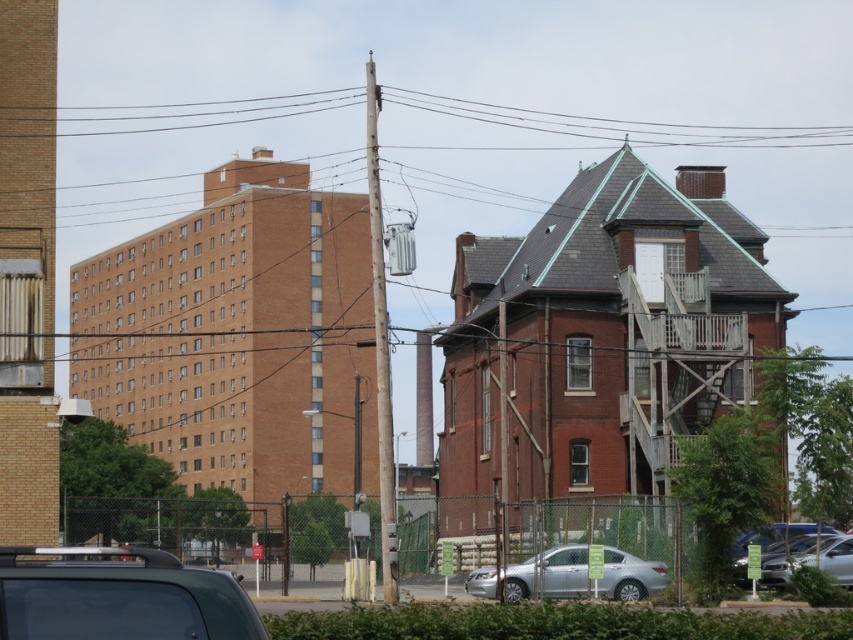
Question: Is silver metallic sedan at center above silver metallic car at lower right?

Choices:
 (A) yes
 (B) no

Answer: (B)

Question: Does silver metallic sedan at center appear on the right side of silver metallic car at lower right?

Choices:
 (A) yes
 (B) no

Answer: (B)

Question: Does silver metallic sedan at center appear on the left side of silver metallic car at lower right?

Choices:
 (A) no
 (B) yes

Answer: (B)

Question: Estimate the real-world distances between objects in this image. Which object is farther from the silver metallic sedan at center?

Choices:
 (A) metallic gray car at lower left
 (B) silver metallic car at lower right

Answer: (A)

Question: Among these points, which one is nearest to the camera?

Choices:
 (A) (793, 532)
 (B) (734, 129)
 (C) (486, 570)

Answer: (C)

Question: Which point appears closest to the camera in this image?

Choices:
 (A) (546, 556)
 (B) (239, 100)
 (C) (755, 540)

Answer: (A)